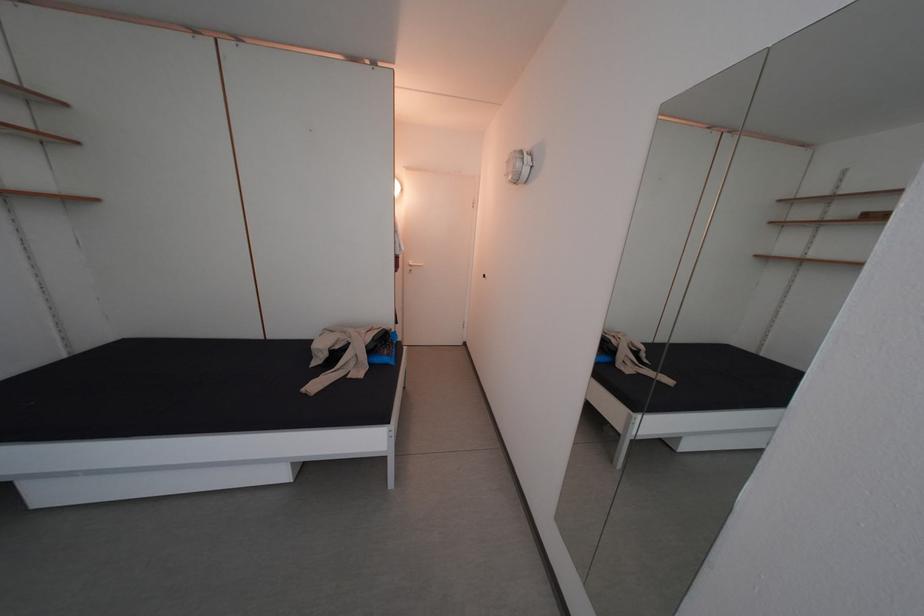
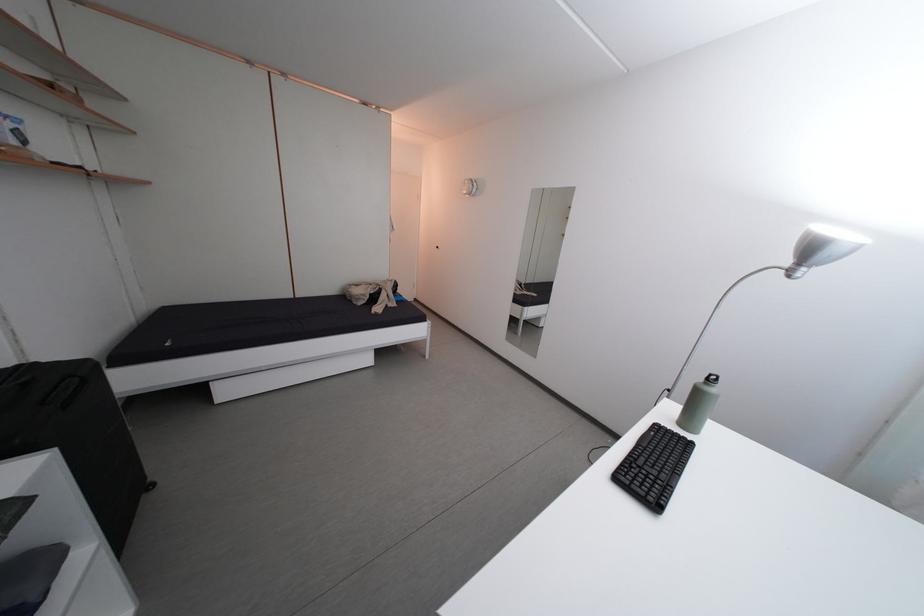
Which direction would the cameraman need to move to produce the second image?

The cameraman walked toward left, backward.